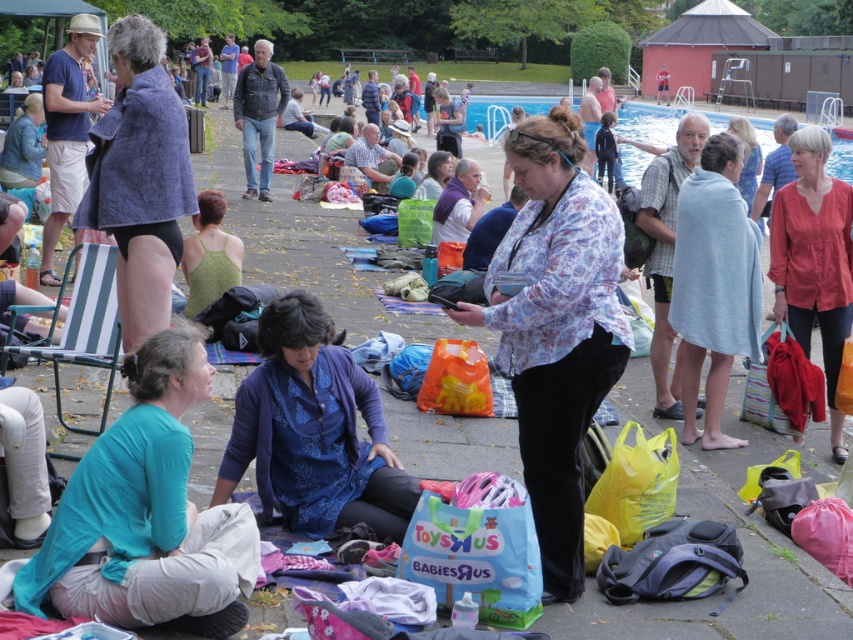
What do you see at coordinates (555, 326) in the screenshot? I see `floral print blouse at center` at bounding box center [555, 326].

Where is `floral print blouse at center`? The width and height of the screenshot is (853, 640). floral print blouse at center is located at coordinates (555, 326).

Locate an element on the screen. This screenshot has width=853, height=640. floral print blouse at center is located at coordinates (555, 326).

Does blue towel at upper left appear under floral fabric shirt at center?

Indeed, blue towel at upper left is positioned under floral fabric shirt at center.

This screenshot has width=853, height=640. What do you see at coordinates (140, 179) in the screenshot?
I see `blue towel at upper left` at bounding box center [140, 179].

Where is `blue towel at upper left`? This screenshot has height=640, width=853. blue towel at upper left is located at coordinates (140, 179).

This screenshot has height=640, width=853. What are the coordinates of `blue towel at upper left` in the screenshot? It's located at (140, 179).

Can you confirm if red cotton shirt at right is shorter than blue smooth water at upper center?

Correct, red cotton shirt at right is not as tall as blue smooth water at upper center.

Does red cotton shirt at right appear on the right side of blue smooth water at upper center?

Incorrect, red cotton shirt at right is not on the right side of blue smooth water at upper center.

Where is `red cotton shirt at right`? This screenshot has height=640, width=853. red cotton shirt at right is located at coordinates (814, 259).

Identify the location of red cotton shirt at right. Image resolution: width=853 pixels, height=640 pixels. (814, 259).